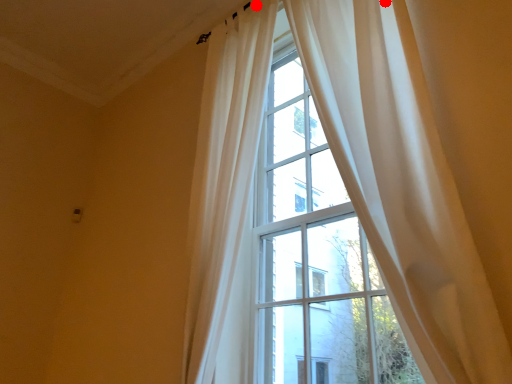
Question: Two points are circled on the image, labeled by A and B beside each circle. Which point is farther to the camera?

Choices:
 (A) A is further
 (B) B is further

Answer: (A)